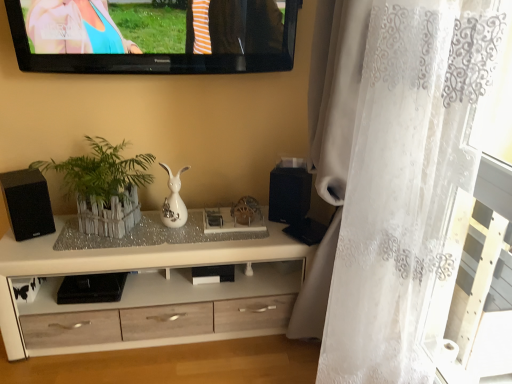
Question: Should I look upward or downward to see black glossy television at upper center?

Choices:
 (A) up
 (B) down

Answer: (A)

Question: From the image's perspective, would you say black glossy television at upper center is positioned over white wood cabinet at center?

Choices:
 (A) no
 (B) yes

Answer: (B)

Question: Does black glossy television at upper center have a lesser width compared to white wood cabinet at center?

Choices:
 (A) yes
 (B) no

Answer: (A)

Question: Is black glossy television at upper center turned away from white wood cabinet at center?

Choices:
 (A) no
 (B) yes

Answer: (A)

Question: Considering the relative positions of black glossy television at upper center and white wood cabinet at center in the image provided, is black glossy television at upper center to the right of white wood cabinet at center from the viewer's perspective?

Choices:
 (A) no
 (B) yes

Answer: (B)

Question: Is black glossy television at upper center touching white wood cabinet at center?

Choices:
 (A) no
 (B) yes

Answer: (A)

Question: Does black glossy television at upper center contain white wood cabinet at center?

Choices:
 (A) no
 (B) yes

Answer: (A)

Question: From a real-world perspective, is white glossy vase at center physically above white lace curtain at right?

Choices:
 (A) yes
 (B) no

Answer: (B)

Question: Is the depth of white glossy vase at center greater than that of white lace curtain at right?

Choices:
 (A) yes
 (B) no

Answer: (A)

Question: Considering the relative sizes of white glossy vase at center and white lace curtain at right in the image provided, is white glossy vase at center smaller than white lace curtain at right?

Choices:
 (A) yes
 (B) no

Answer: (A)

Question: Can you confirm if white glossy vase at center is thinner than white lace curtain at right?

Choices:
 (A) yes
 (B) no

Answer: (A)

Question: Is white glossy vase at center at the right side of white lace curtain at right?

Choices:
 (A) no
 (B) yes

Answer: (A)

Question: From a real-world perspective, is white glossy vase at center physically below white lace curtain at right?

Choices:
 (A) no
 (B) yes

Answer: (B)

Question: Is black matte speaker at center, which is the 1th speaker from right to left, beside white wooden fence at center?

Choices:
 (A) no
 (B) yes

Answer: (A)